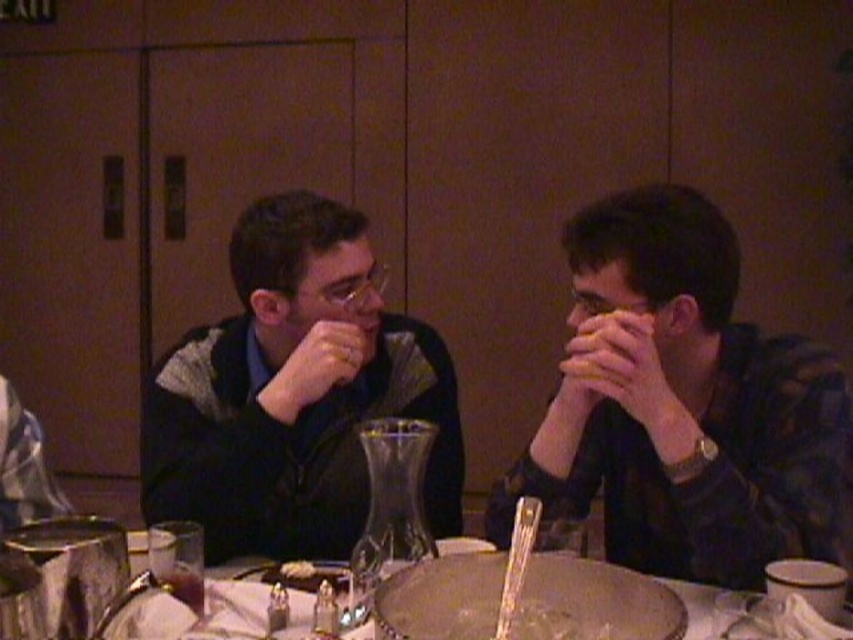
Question: Does white glossy table at center appear on the left side of white matte bread at center?

Choices:
 (A) yes
 (B) no

Answer: (A)

Question: Does matte black jacket at center appear over white crumbly food at center?

Choices:
 (A) yes
 (B) no

Answer: (A)

Question: Which point is farther to the camera?

Choices:
 (A) (619, 362)
 (B) (300, 572)

Answer: (B)

Question: Which object is positioned closest to the white crumbly food at center?

Choices:
 (A) white matte bread at center
 (B) white glossy table at center
 (C) clear glass at lower left

Answer: (B)

Question: Can you confirm if white matte bread at center is positioned to the left of clear glass at lower left?

Choices:
 (A) no
 (B) yes

Answer: (A)

Question: Which of these objects is positioned closest to the white glossy table at center?

Choices:
 (A) dark plaid shirt at center
 (B) white crumbly food at center

Answer: (B)